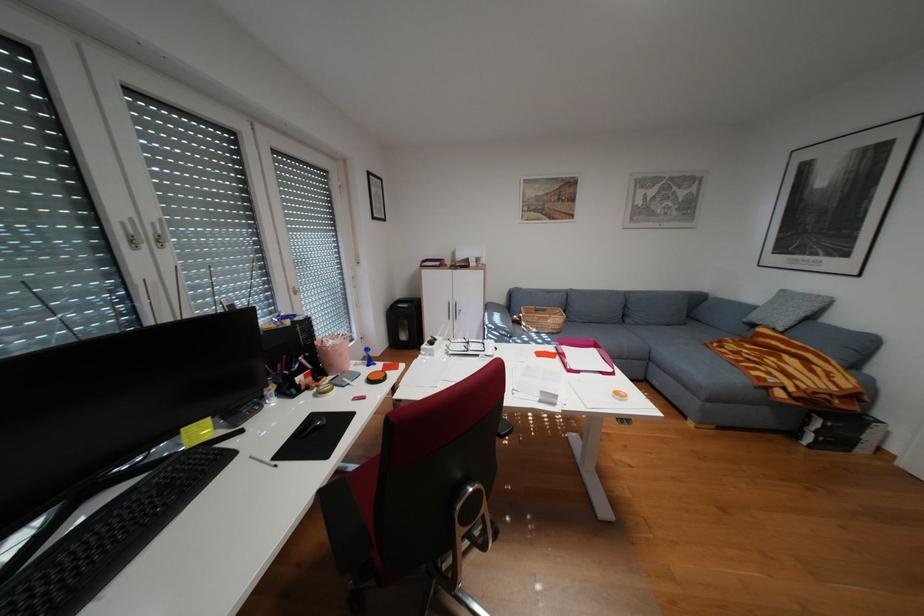
I want to click on grey sofa sitting surface, so click(661, 334).